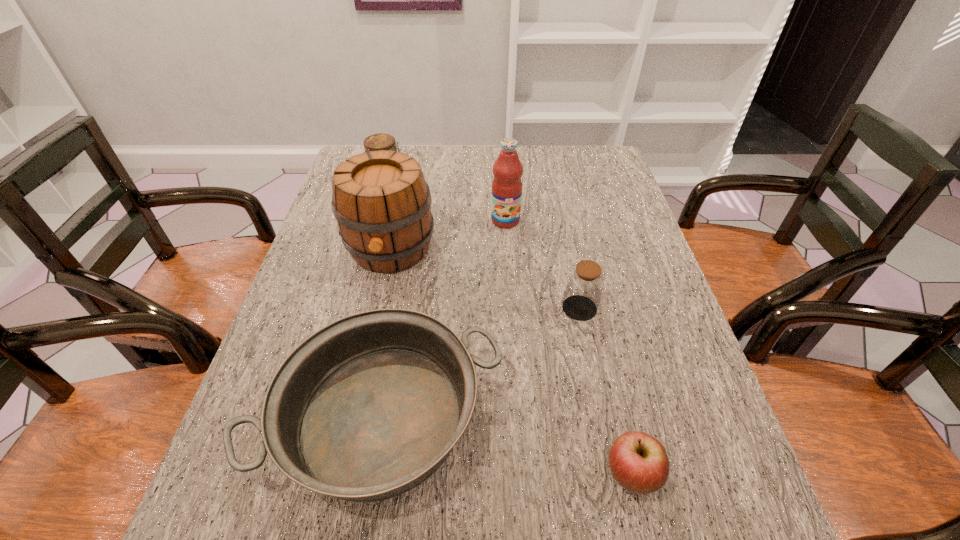
Image resolution: width=960 pixels, height=540 pixels. In order to click on free spot that satisfies the following two spatial constraints: 1. on the side of the cider where the spigot is located; 2. on the left side of the apple in this screenshot , I will do `click(342, 476)`.

This screenshot has width=960, height=540. Find the location of `free location that satisfies the following two spatial constraints: 1. on the front label of the fruit juice; 2. on the left side of the apple`. free location that satisfies the following two spatial constraints: 1. on the front label of the fruit juice; 2. on the left side of the apple is located at coordinates (522, 476).

At what (x,y) coordinates should I click in order to perform the action: click on free space that satisfies the following two spatial constraints: 1. on the lid of the left jar; 2. on the left side of the right jar. Please return your answer as a coordinate pair (x, y). The width and height of the screenshot is (960, 540). Looking at the image, I should click on click(353, 308).